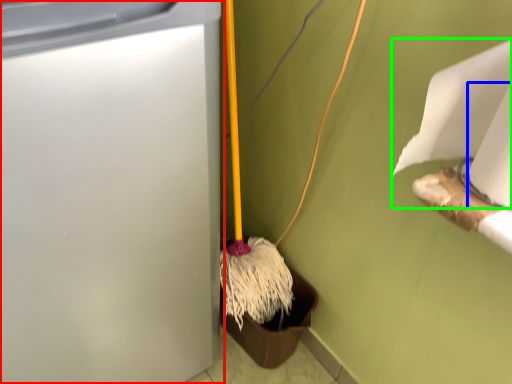
Question: Which object is positioned farthest from waste container (highlighted by a red box)? Select from toilet paper (highlighted by a blue box) and toilet paper (highlighted by a green box).

Choices:
 (A) toilet paper
 (B) toilet paper

Answer: (A)